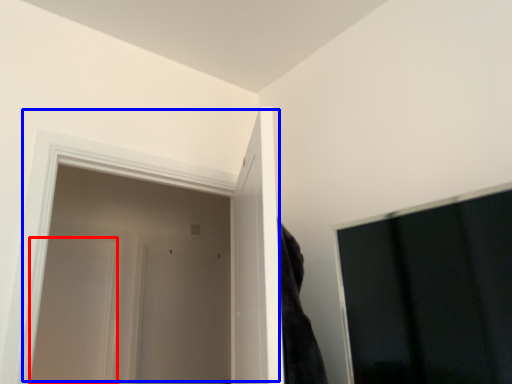
Question: Which object is further to the camera taking this photo, door (highlighted by a red box) or door (highlighted by a blue box)?

Choices:
 (A) door
 (B) door

Answer: (A)